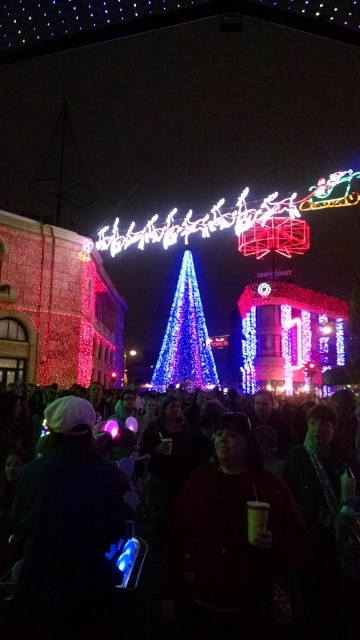
Does black fabric crowd at lower center appear over dark matte sweatshirt at center?

Correct, black fabric crowd at lower center is located above dark matte sweatshirt at center.

I want to click on black fabric crowd at lower center, so tap(232, 541).

What do you see at coordinates (232, 541) in the screenshot?
I see `black fabric crowd at lower center` at bounding box center [232, 541].

Where is `black fabric crowd at lower center`? black fabric crowd at lower center is located at coordinates (232, 541).

Is dark matte sweatshirt at center behind blue led lights at center?

No, dark matte sweatshirt at center is closer to the viewer.

Is dark matte sweatshirt at center shorter than blue led lights at center?

Correct, dark matte sweatshirt at center is not as tall as blue led lights at center.

Which is behind, point (177, 532) or point (174, 326)?

The point (174, 326) is more distant.

I want to click on dark matte sweatshirt at center, so click(231, 544).

Based on the photo, between black fabric crowd at lower center and blue led lights at center, which one appears on the left side from the viewer's perspective?

From the viewer's perspective, blue led lights at center appears more on the left side.

Does black fabric crowd at lower center have a smaller size compared to blue led lights at center?

Actually, black fabric crowd at lower center might be larger than blue led lights at center.

Does point (214, 477) come in front of point (174, 371)?

That is True.

At what (x,y) coordinates should I click in order to perform the action: click on black fabric crowd at lower center. Please return your answer as a coordinate pair (x, y). Image resolution: width=360 pixels, height=640 pixels. Looking at the image, I should click on (232, 541).